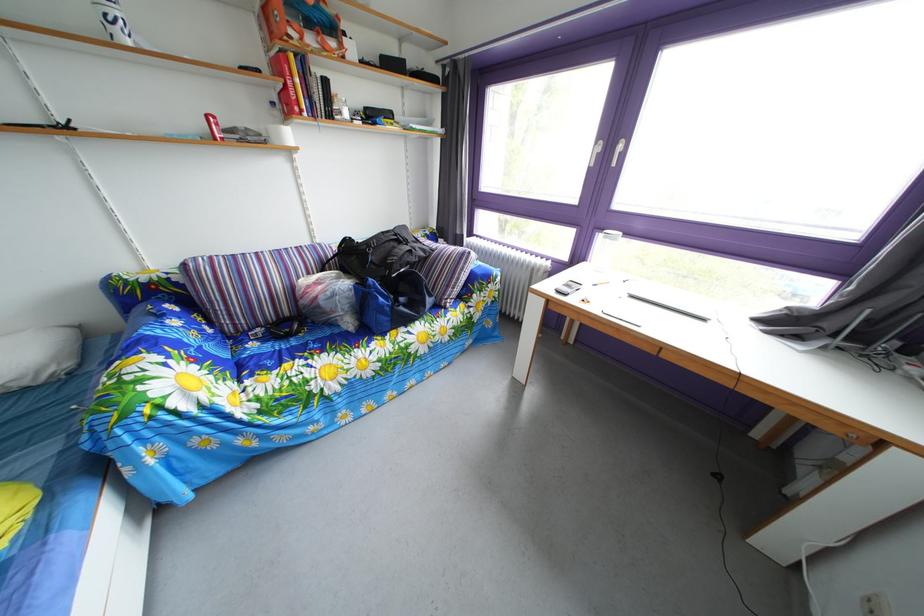
This screenshot has width=924, height=616. I want to click on white pillow, so click(38, 355).